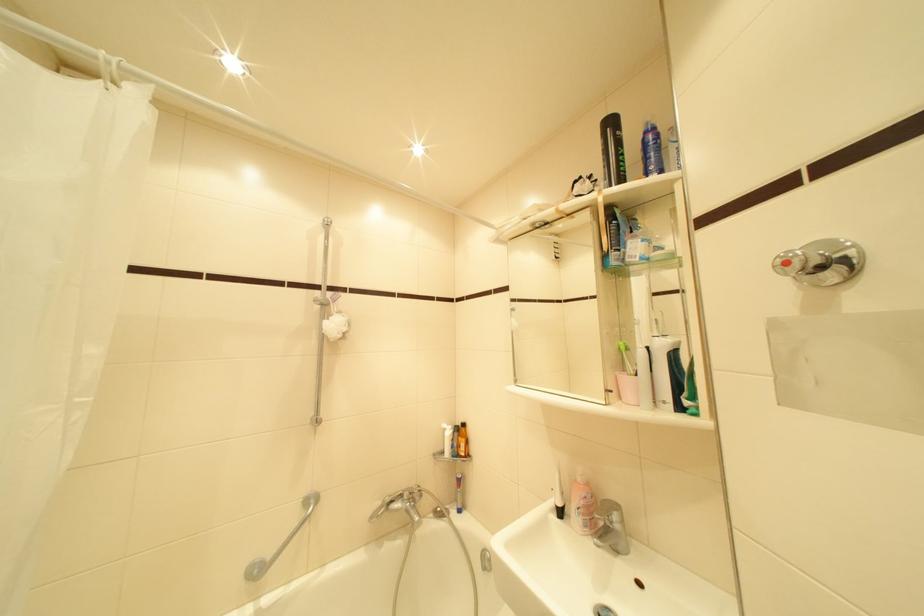
Find where to pull the shower diverter knob. Please return your answer as a coordinate pair (x, y).

(833, 254)